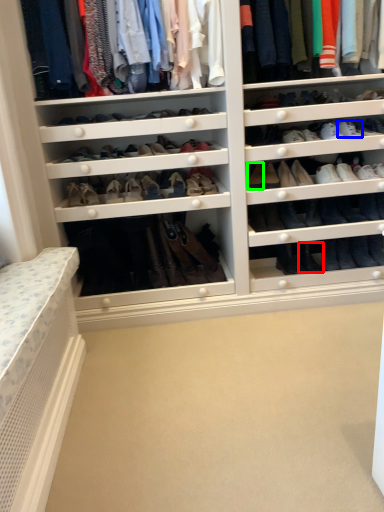
Question: Based on their relative distances, which object is nearer to shoe (highlighted by a red box)? Choose from shoe (highlighted by a blue box) and shoe (highlighted by a green box).

Choices:
 (A) shoe
 (B) shoe

Answer: (B)